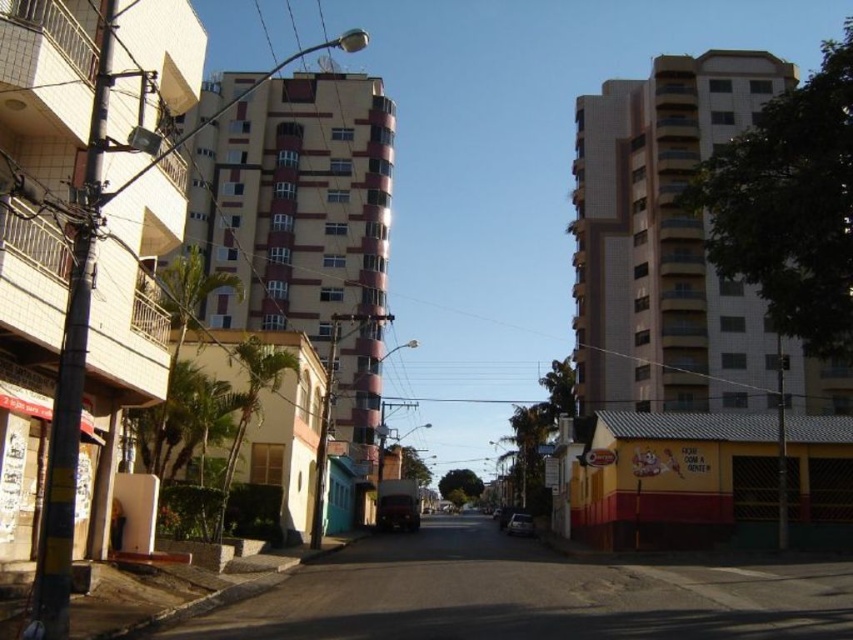
Question: Which of the following is the farthest from the observer?

Choices:
 (A) metallic silver car at center
 (B) shiny black car at center
 (C) smooth concrete road at center

Answer: (B)

Question: Estimate the real-world distances between objects in this image. Which object is closer to the smooth concrete road at center?

Choices:
 (A) metallic silver car at center
 (B) shiny black car at center

Answer: (B)

Question: Is shiny black car at center above metallic silver car at center?

Choices:
 (A) yes
 (B) no

Answer: (A)

Question: Which object appears closest to the camera in this image?

Choices:
 (A) smooth concrete road at center
 (B) shiny black car at center
 (C) metallic silver car at center

Answer: (A)

Question: Is shiny black car at center positioned in front of metallic silver car at center?

Choices:
 (A) no
 (B) yes

Answer: (A)

Question: Is smooth concrete road at center further to camera compared to shiny black car at center?

Choices:
 (A) yes
 (B) no

Answer: (B)